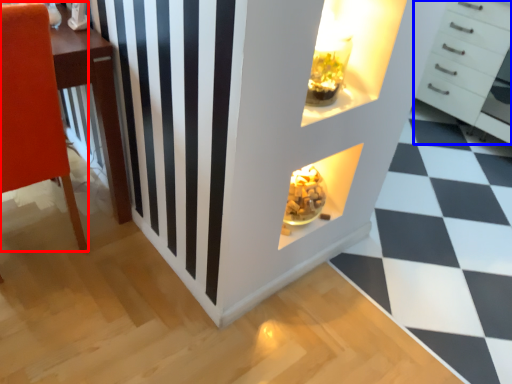
Question: Which of the following is the closest to the observer, furniture (highlighted by a red box) or chest of drawers (highlighted by a blue box)?

Choices:
 (A) furniture
 (B) chest of drawers

Answer: (A)